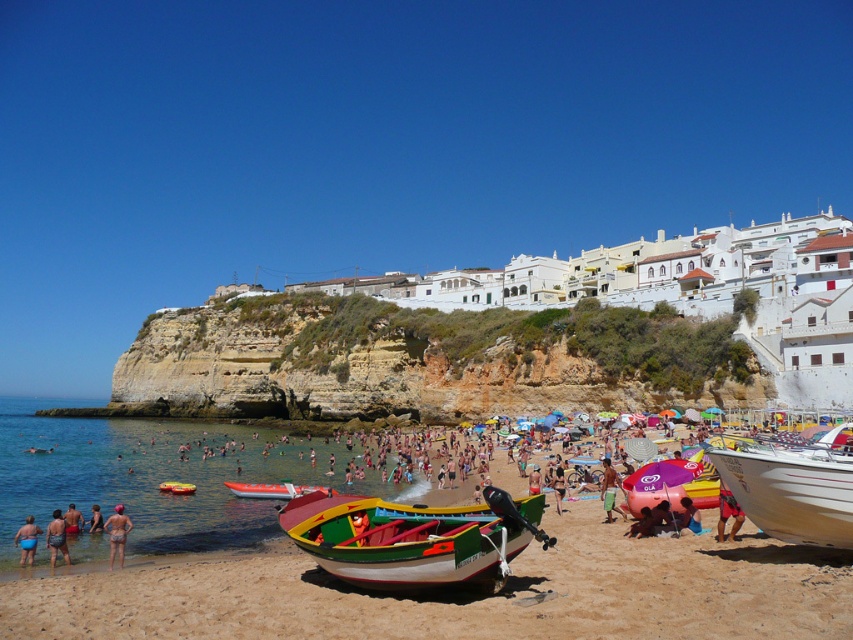
You are standing on the beach and see the matte skin person at lower left and the red glossy boat at lower left. Which object is higher in position?

The matte skin person at lower left is above the red glossy boat at lower left, so the matte skin person at lower left is higher in position.

You are standing on the beach and see the orange fiberglass boat at center and the green fabric bucket at center. Which object is closer to you?

The orange fiberglass boat at center is closer to you because it is further to the viewer than the green fabric bucket at center.

You are standing at the beach and want to walk from point (80, 516) to point (602, 468). Given the scene description, which direction should you move relative to the cliff face?

You should move towards the cliff face because point (602, 468) is behind point (80, 516) relative to the cliff face.